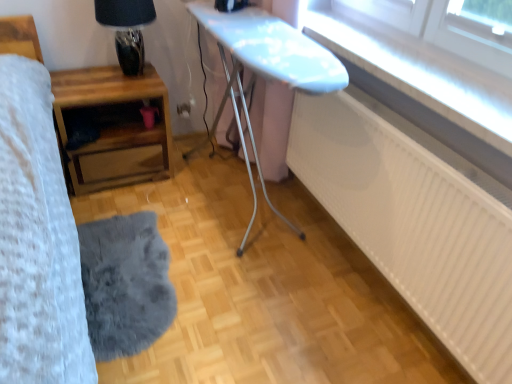
Find the location of a particular element. The height and width of the screenshot is (384, 512). vacant space to the right of gray fluffy mat at lower left is located at coordinates (251, 284).